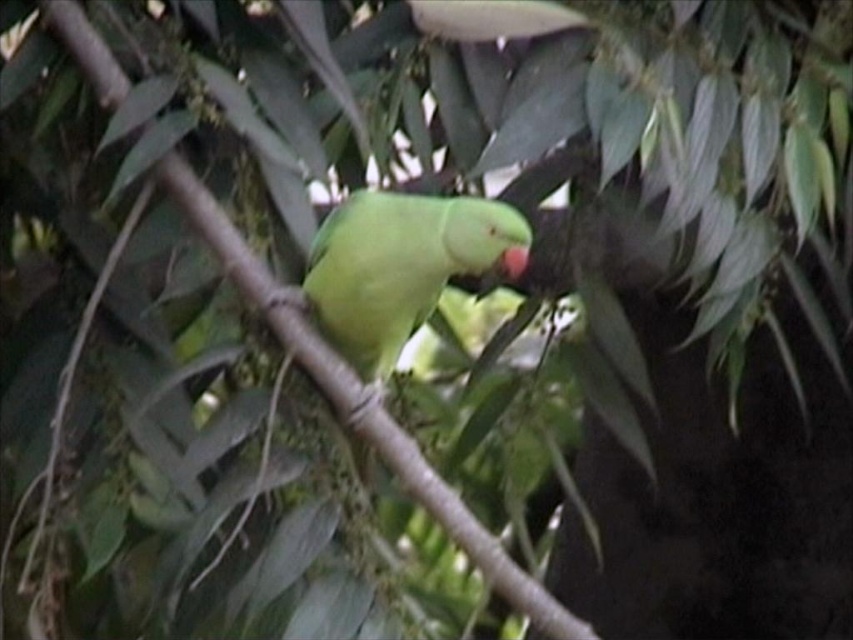
You are a photographer aiming to capture the green matte parrot at center. You have a camera with a focus point at coordinates point [396,268]. Will this focus point land on the parrot?

Yes, the focus point at point [396,268] is on the green matte parrot at center, so it will land on the parrot.

You are a birdwatcher trying to locate two points in the image. The first point is at coordinate point (428, 296) and the second is at point (509, 269). According to the scene description, which point is closer to the observer?

Point (509, 269) is closer to the observer because the description states that point (428, 296) is behind point (509, 269).

You are an ornithologist observing a green matte parrot at center and a green matte beak at center in a dense forest. From your viewpoint, which object appears closer to you?

The green matte parrot at center appears closer because the green matte beak at center is positioned behind it.